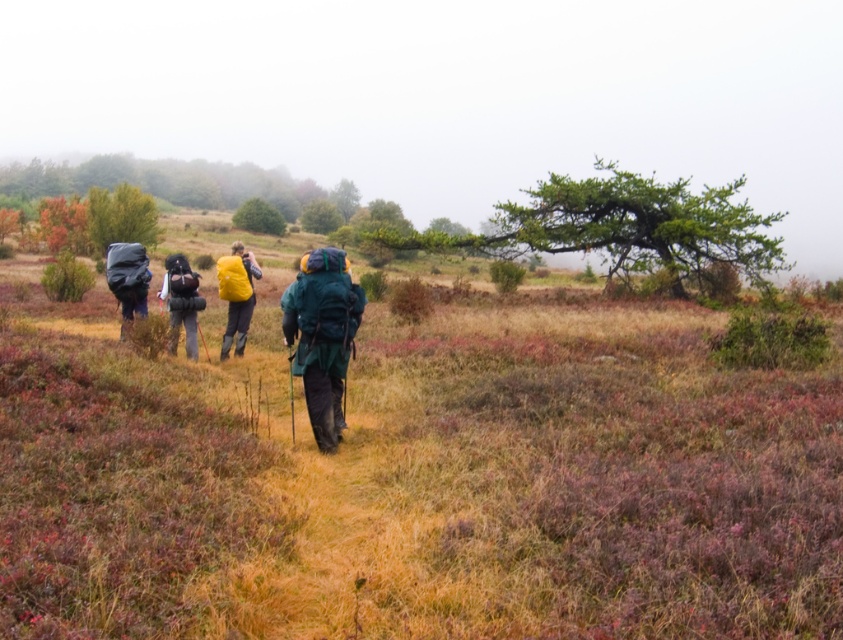
Who is taller, matte yellow backpack at center or matte black backpack at left?

Standing taller between the two is matte yellow backpack at center.

Which is behind, point (229, 282) or point (122, 268)?

Point (122, 268)

At what (x,y) coordinates should I click in order to perform the action: click on matte yellow backpack at center. Please return your answer as a coordinate pair (x, y). This screenshot has height=640, width=843. Looking at the image, I should click on (235, 294).

Does matte yellow backpack at center lie behind matte black backpack at center?

Yes.

Based on the photo, who is lower down, matte yellow backpack at center or matte black backpack at center?

Positioned lower is matte black backpack at center.

Between point (224, 349) and point (181, 273), which one is positioned behind?

Point (224, 349)

Where is `matte yellow backpack at center`? The height and width of the screenshot is (640, 843). matte yellow backpack at center is located at coordinates (235, 294).

Which is above, matte black backpack at center or matte black backpack at left?

matte black backpack at center is above.

Between matte black backpack at center and matte black backpack at left, which one appears on the left side from the viewer's perspective?

Positioned to the left is matte black backpack at left.

Image resolution: width=843 pixels, height=640 pixels. In order to click on matte black backpack at center in this screenshot , I will do `click(181, 301)`.